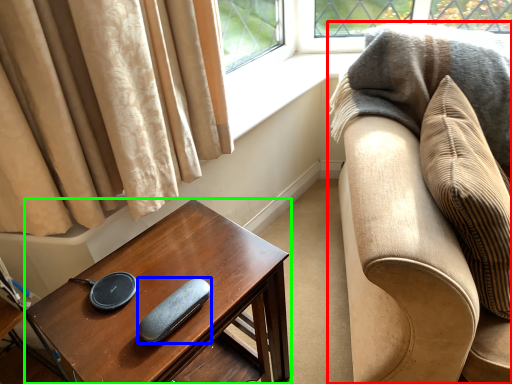
Question: Considering the real-world distances, which object is farthest from studio couch (highlighted by a red box)? pad (highlighted by a blue box) or table (highlighted by a green box)?

Choices:
 (A) pad
 (B) table

Answer: (A)